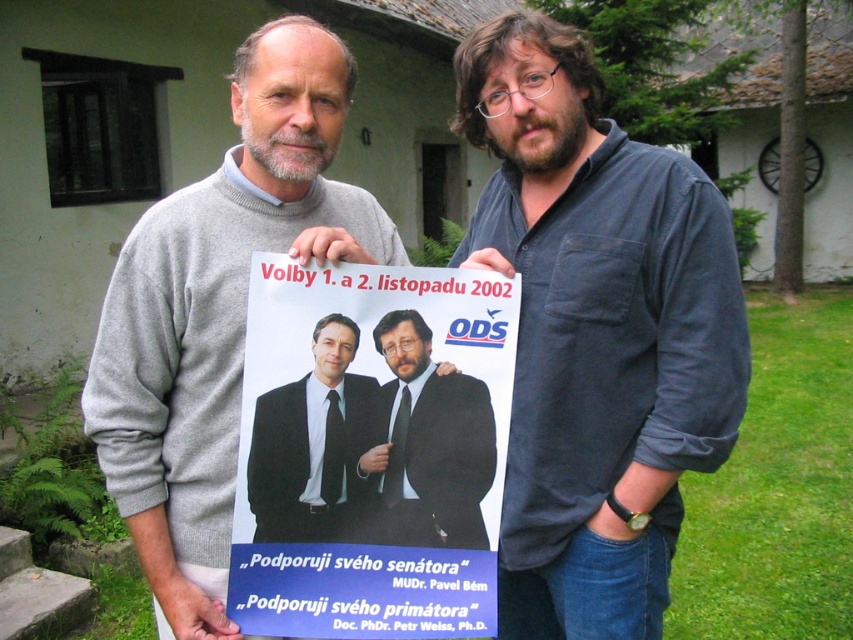
Does dark blue shirt at center appear under matte black suit at center?

Actually, dark blue shirt at center is above matte black suit at center.

Is point (635, 314) farther from camera compared to point (405, 460)?

Yes, it is.

At what (x,y) coordinates should I click in order to perform the action: click on dark blue shirt at center. Please return your answer as a coordinate pair (x, y). Image resolution: width=853 pixels, height=640 pixels. Looking at the image, I should click on (596, 333).

How distant is dark blue shirt at center from black suit at center?

A distance of 36.31 centimeters exists between dark blue shirt at center and black suit at center.

Describe the element at coordinates (596, 333) in the screenshot. I see `dark blue shirt at center` at that location.

Is point (660, 636) positioned after point (264, 428)?

Yes.

I want to click on dark blue shirt at center, so click(x=596, y=333).

Between blue paper poster at center and matte black suit at center, which one is positioned higher?

matte black suit at center is higher up.

Is blue paper poster at center closer to the viewer compared to matte black suit at center?

Yes, it is in front of matte black suit at center.

Image resolution: width=853 pixels, height=640 pixels. Identify the location of blue paper poster at center. (369, 449).